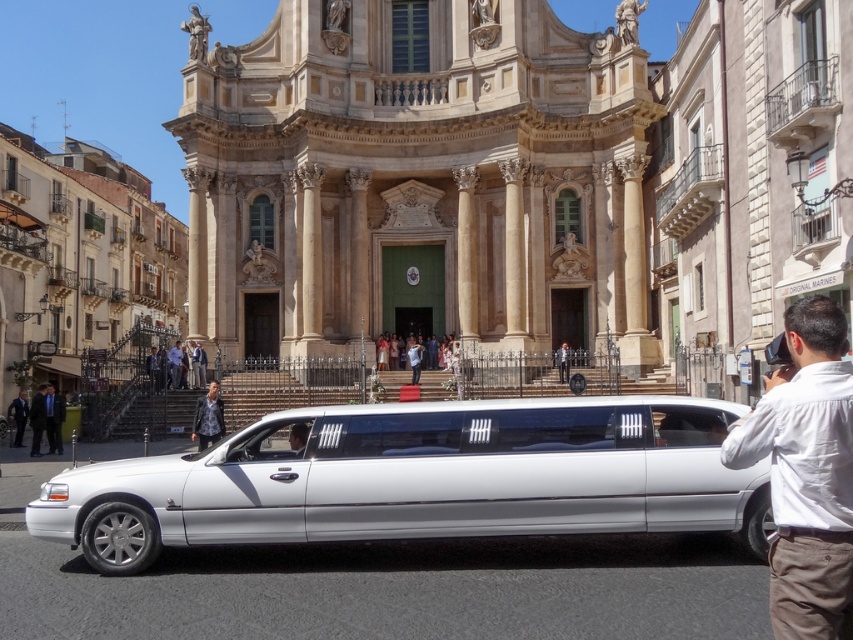
You are standing at the base of the cathedral steps and want to take a photo that includes both the green door and the statues on the facade. You notice two points marked in the scene. Which point, point (18, 401) or point (289, 445), is closer to your camera position?

Point (18, 401) is further to the camera than point (289, 445), so the point closer to your camera position is point (289, 445).

You are a photographer standing at the bottom of the steps in front of the grand building. You want to take a photo that includes both the dark blue suit at center and the dark suit at lower left. Which of the two suits should you focus on first if you want to ensure both are in the frame?

You should focus on the dark suit at lower left first because the dark blue suit at center is below it, so adjusting the camera angle to include the lower position might require a wider or adjusted framing that starts from the higher position.